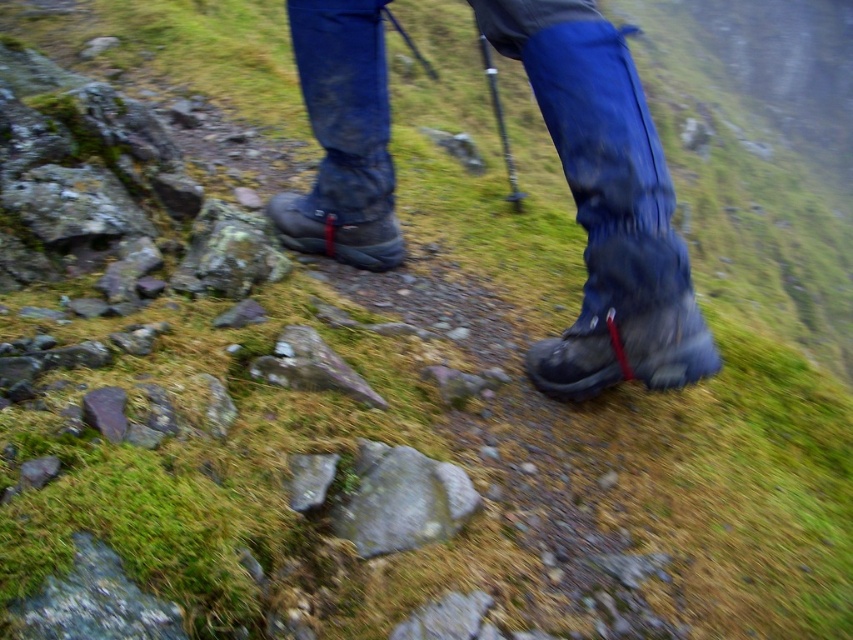
Can you confirm if matte black hiking boot at center is smaller than matte black boot at center?

Incorrect, matte black hiking boot at center is not smaller in size than matte black boot at center.

Can you confirm if matte black hiking boot at center is shorter than matte black boot at center?

No.

Between point (320, 51) and point (305, 212), which one is positioned in front?

Point (320, 51) is more forward.

Identify the location of matte black hiking boot at center. (606, 205).

Describe the element at coordinates (625, 348) in the screenshot. Image resolution: width=853 pixels, height=640 pixels. I see `matte black boot at lower right` at that location.

Does matte black boot at lower right have a larger size compared to matte black boot at center?

Indeed, matte black boot at lower right has a larger size compared to matte black boot at center.

What do you see at coordinates (625, 348) in the screenshot? The height and width of the screenshot is (640, 853). I see `matte black boot at lower right` at bounding box center [625, 348].

Where is `matte black boot at lower right`? This screenshot has width=853, height=640. matte black boot at lower right is located at coordinates (625, 348).

Can you confirm if matte black hiking boot at center is positioned to the right of matte black boot at lower right?

Yes, matte black hiking boot at center is to the right of matte black boot at lower right.

Who is more forward, (622, 348) or (624, 298)?

Point (624, 298) is in front.

The image size is (853, 640). Find the location of `matte black hiking boot at center`. matte black hiking boot at center is located at coordinates tap(606, 205).